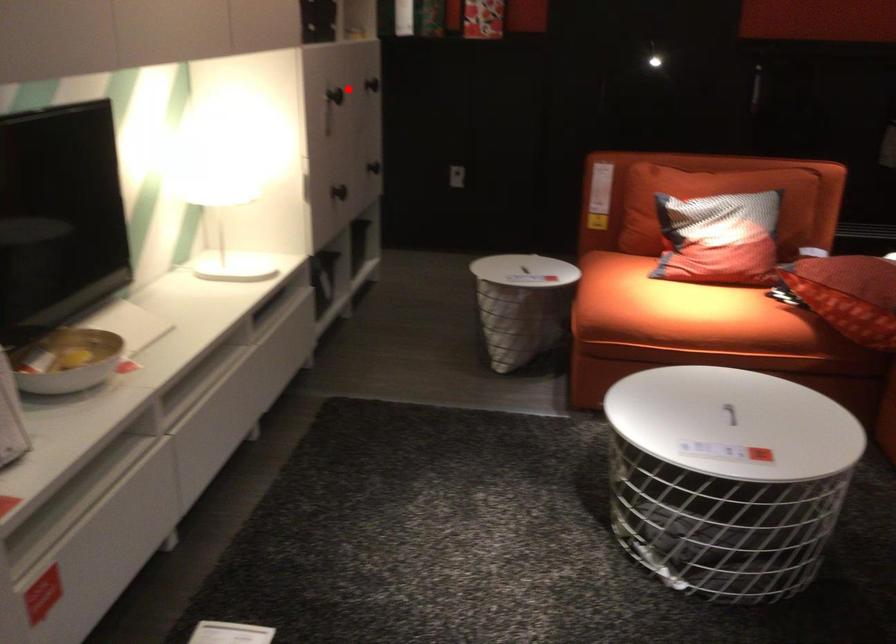
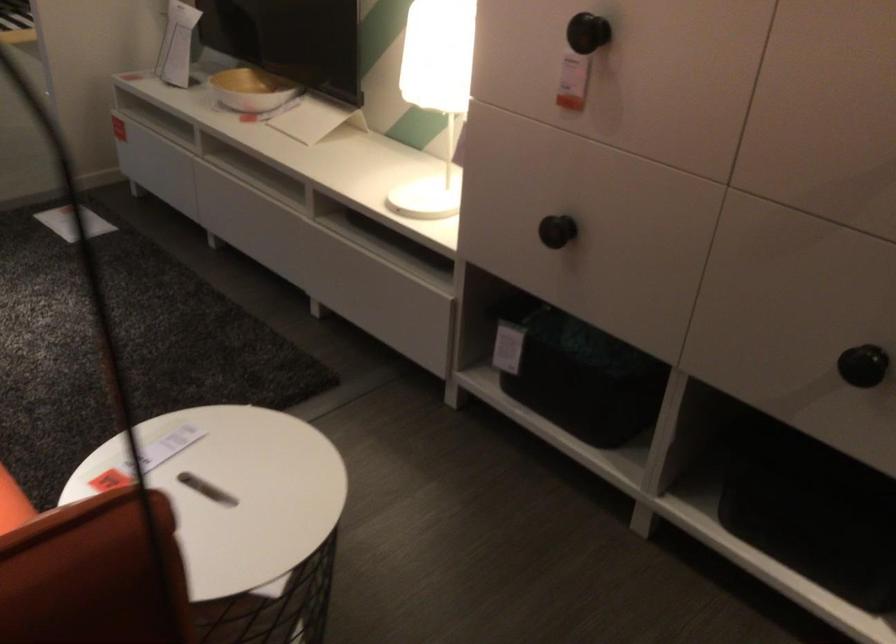
In the second image, find the point that corresponds to the highlighted location in the first image.

(588, 33)